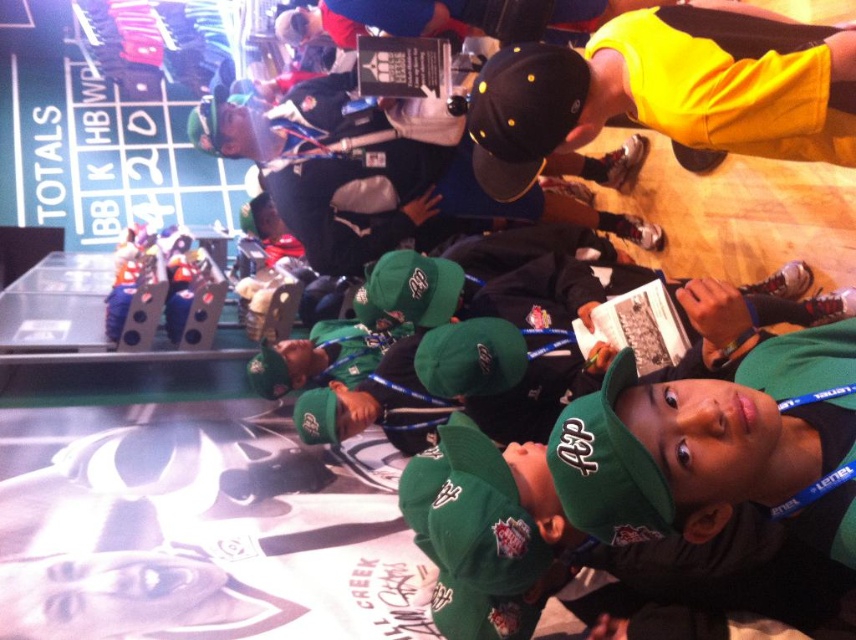
Looking at this image, you are a photographer standing at the back of the room. You want to take a photo of the green fabric cap at center and the blue fabric cap at right so that both are in focus. The minimum focusing distance of your camera is 40 inches. Can you take the photo without moving either object?

The distance between the green fabric cap at center and the blue fabric cap at right is 39.17 inches, which is less than the camera minimum focusing distance of 40 inches. Therefore, you can take the photo without moving either object.

You are a photographer trying to capture both the black matte baseball cap at upper center and the green fabric baseball cap at center in a single frame. Based on their sizes, which cap would appear bigger in the photo?

The black matte baseball cap at upper center would appear bigger in the photo since it has a larger size compared to the green fabric baseball cap at center.